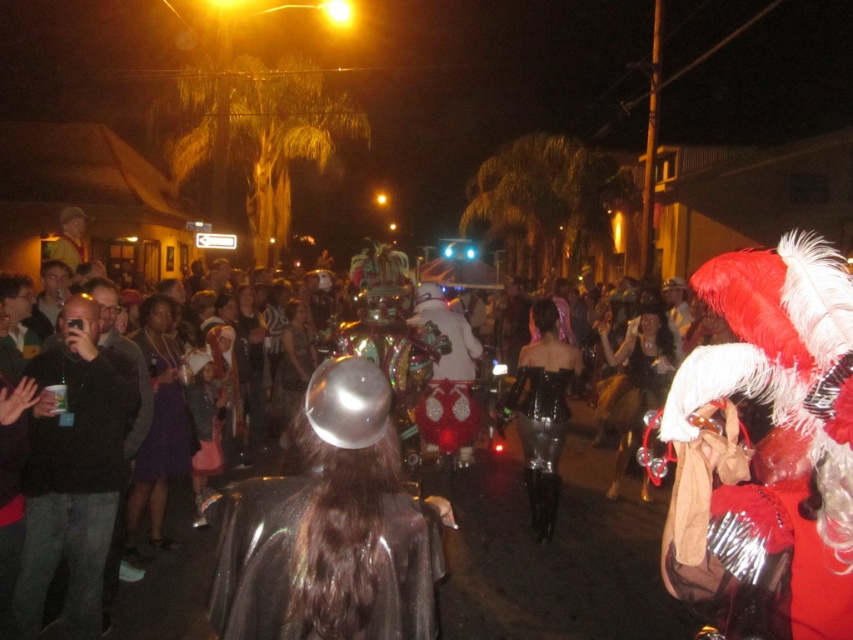
You are a photographer standing at the edge of the crowd, wanting to capture a clear shot of the shiny black dress at center. The camera you are using has a minimum focusing distance of 20 feet. Can you adjust your position to take the photo without moving closer than 20 feet?

The shiny black dress at center is 19.45 feet from the viewer. Since the minimum focusing distance is 20 feet, you cannot take the photo without moving further back to at least 20 feet. However, since the dress is already closer than that, you would need to move back to comply with the camera requirement.

You are a photographer trying to capture the festive atmosphere. You notice the shiny metallic helmet at center and the white matte costume at center. Which object is positioned higher in the frame?

The shiny metallic helmet at center is located above the white matte costume at center, so it is positioned higher in the frame.

You are a photographer trying to capture both the shiny metallic costume at center and the shiny black dress at center in a single shot. Which of the two will appear shorter in the photo?

The shiny metallic costume at center will appear shorter in the photo because it has a lesser height compared to the shiny black dress at center.